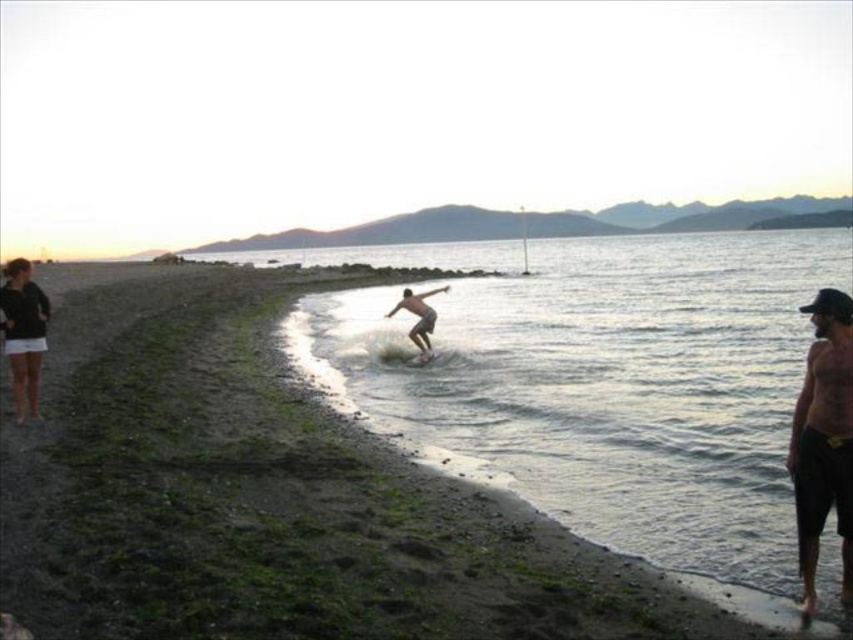
You are a surfer planning to ride the surfboard. Based on the scene, can you tell if the smooth tan surfboard at center is currently submerged in the clear water at center?

The clear water at center is located above the smooth tan surfboard at center, so the surfboard is submerged in the water.

You are planning to place a 1.5 meter wide surfboard on the beach. Based on the image, can the clear water at center accommodate the smooth tan surfboard at center?

The clear water at center might be wider than smooth tan surfboard at center, so it could potentially accommodate the 1.5 meter wide surfboard.

You are a photographer planning to take a photo of the beach scene. You want to ensure both the black matte shorts at right and the white foam surfboard at center are clearly visible in the frame. Based on their positions, which object is closer to the camera?

The black matte shorts at right is located below the white foam surfboard at center, which means it is closer to the camera.